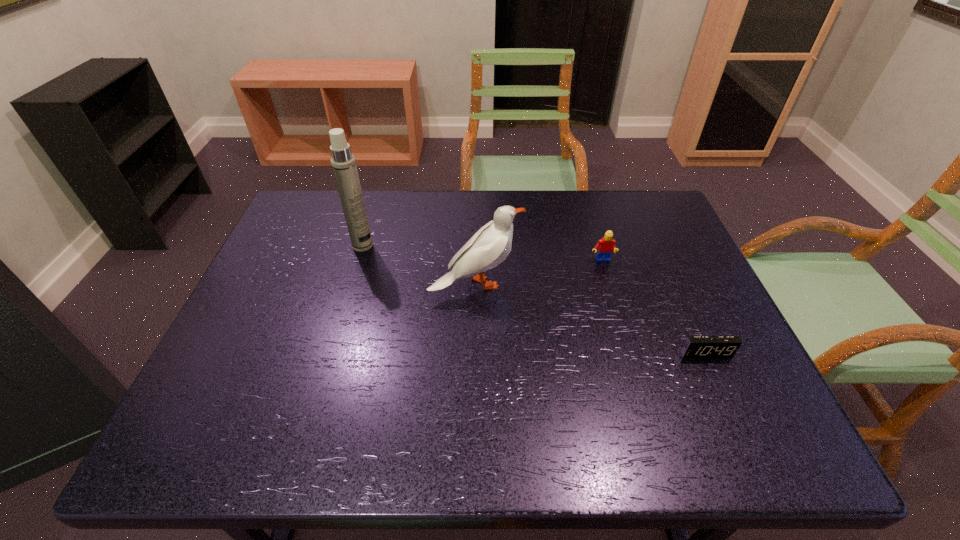
You are a GUI agent. You are given a task and a screenshot of the screen. Output one action in this format:
    pyautogui.click(x=<x>, y=<y>)
    Task: Click on the leftmost object
    Image resolution: width=960 pixels, height=540 pixels.
    Given the screenshot: What is the action you would take?
    343,163

Find the location of `aerosol can`. aerosol can is located at coordinates (343, 163).

At what (x,y) coordinates should I click in order to perform the action: click on gull. Please return your answer as a coordinate pair (x, y). This screenshot has height=540, width=960. Looking at the image, I should click on (490, 245).

Image resolution: width=960 pixels, height=540 pixels. I want to click on the third farthest object, so click(x=490, y=245).

Locate an element on the screen. This screenshot has height=540, width=960. the third object from left to right is located at coordinates (605, 246).

The height and width of the screenshot is (540, 960). Find the location of `Lego`. Lego is located at coordinates (605, 246).

This screenshot has height=540, width=960. In order to click on the shortest object in this screenshot , I will do `click(695, 346)`.

Identify the location of alarm clock. (695, 346).

Where is `free location located 0.220m on the right of the leftmost object`? Image resolution: width=960 pixels, height=540 pixels. free location located 0.220m on the right of the leftmost object is located at coordinates (449, 246).

Where is `free location located at the beak of the gull`? free location located at the beak of the gull is located at coordinates (617, 284).